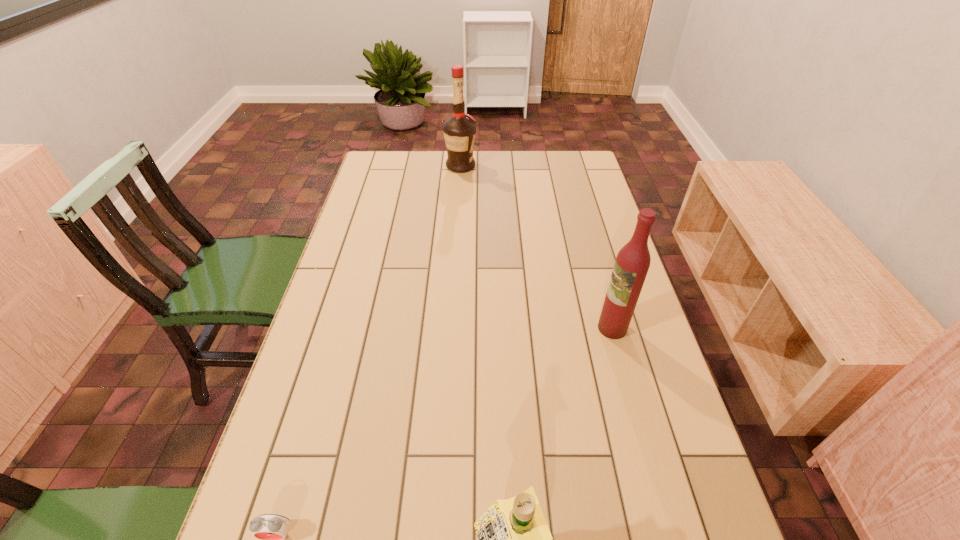
The image size is (960, 540). Find the location of `the third object from right to left`. the third object from right to left is located at coordinates (459, 131).

Where is `the farthest liquor`? the farthest liquor is located at coordinates (459, 131).

Where is `the second farthest liquor`? This screenshot has height=540, width=960. the second farthest liquor is located at coordinates (632, 263).

Image resolution: width=960 pixels, height=540 pixels. I want to click on the rightmost liquor, so click(x=632, y=263).

Where is `vacant space located on the front and back of the farthest object`? The image size is (960, 540). vacant space located on the front and back of the farthest object is located at coordinates (542, 166).

Where is `vacant space located on the label of the second nearest liquor`? The image size is (960, 540). vacant space located on the label of the second nearest liquor is located at coordinates (521, 328).

Where is `vacant space located 0.300m on the label of the second nearest liquor`? Image resolution: width=960 pixels, height=540 pixels. vacant space located 0.300m on the label of the second nearest liquor is located at coordinates (483, 328).

In order to click on vacant area situated on the label of the second nearest liquor in this screenshot , I will do `click(571, 328)`.

Where is `object located at the far edge`? This screenshot has width=960, height=540. object located at the far edge is located at coordinates (459, 131).

Locate an element on the screen. The height and width of the screenshot is (540, 960). object that is at the right edge is located at coordinates (632, 263).